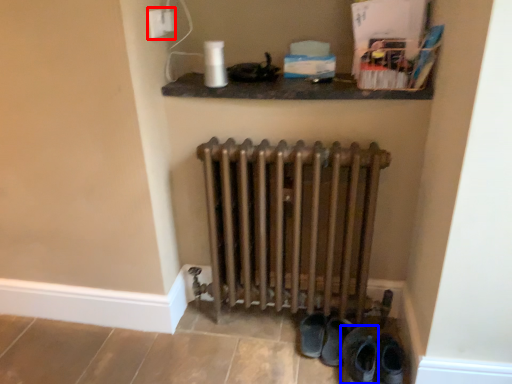
Question: Which of the following is the closest to the observer, electric outlet (highlighted by a red box) or footwear (highlighted by a blue box)?

Choices:
 (A) electric outlet
 (B) footwear

Answer: (B)